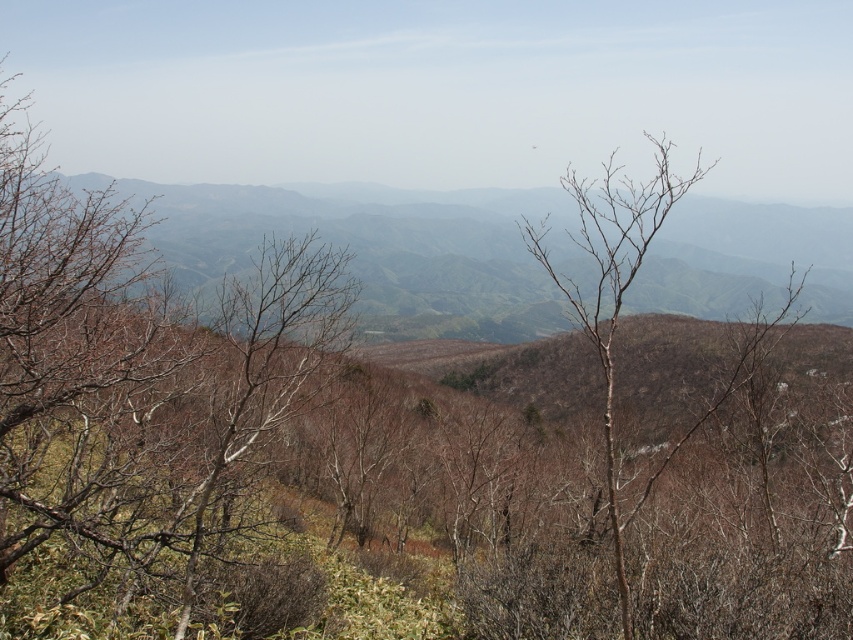
Which is in front, point (41, 307) or point (543, 241)?

Point (41, 307) is in front.

Which is more to the right, brown leafless branches at left or bare branches at center?

bare branches at center

Does point (103, 477) lie in front of point (616, 269)?

No, (103, 477) is further to viewer.

Find the location of `brown leafless branches at left`. brown leafless branches at left is located at coordinates (136, 369).

Does green matte mountain at center have a smaller size compared to bare branches at center?

No, green matte mountain at center is not smaller than bare branches at center.

Is green matte mountain at center below bare branches at center?

Actually, green matte mountain at center is above bare branches at center.

Which is in front, point (666, 234) or point (567, 186)?

Positioned in front is point (567, 186).

At what (x,y) coordinates should I click in order to perform the action: click on green matte mountain at center. Please return your answer as a coordinate pair (x, y). The height and width of the screenshot is (640, 853). Looking at the image, I should click on (368, 250).

Does brown leafless branches at left have a larger size compared to green matte mountain at center?

Actually, brown leafless branches at left might be smaller than green matte mountain at center.

Who is positioned more to the right, brown leafless branches at left or green matte mountain at center?

From the viewer's perspective, green matte mountain at center appears more on the right side.

Does point (33, 240) come farther from viewer compared to point (793, 218)?

That is False.

Where is `brown leafless branches at left`? The width and height of the screenshot is (853, 640). brown leafless branches at left is located at coordinates (136, 369).